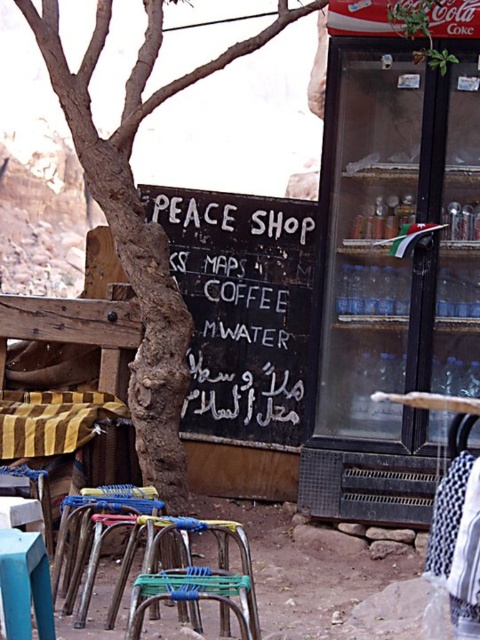
Question: Does black chalkboard at center lie behind metallic blue chair at lower center?

Choices:
 (A) yes
 (B) no

Answer: (A)

Question: Which point is farther to the camera?

Choices:
 (A) metallic blue chair at lower center
 (B) black chalkboard at center

Answer: (B)

Question: Does black chalkboard at center have a greater width compared to metallic blue chair at lower center?

Choices:
 (A) no
 (B) yes

Answer: (B)

Question: Which point is closer to the camera taking this photo?

Choices:
 (A) (303, 225)
 (B) (213, 577)

Answer: (B)

Question: Does black chalkboard at center appear on the left side of metallic blue chair at lower center?

Choices:
 (A) no
 (B) yes

Answer: (A)